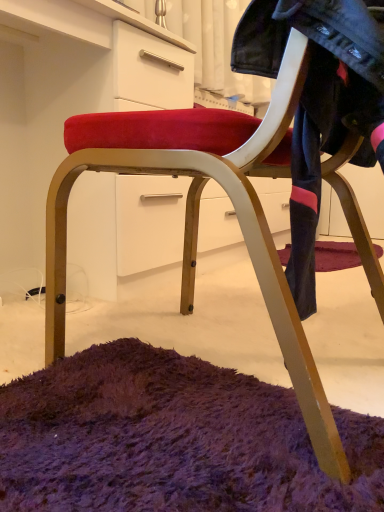
Question: Looking at the image, does matte white dresser at center seem bigger or smaller compared to denim jacket at upper right?

Choices:
 (A) small
 (B) big

Answer: (B)

Question: Considering the positions of matte white dresser at center and denim jacket at upper right in the image, is matte white dresser at center wider or thinner than denim jacket at upper right?

Choices:
 (A) thin
 (B) wide

Answer: (B)

Question: From a real-world perspective, relative to denim jacket at upper right, is matte white dresser at center vertically above or below?

Choices:
 (A) above
 (B) below

Answer: (B)

Question: Based on their sizes in the image, would you say denim jacket at upper right is bigger or smaller than matte white dresser at center?

Choices:
 (A) small
 (B) big

Answer: (A)

Question: Considering the positions of denim jacket at upper right and matte white dresser at center in the image, is denim jacket at upper right taller or shorter than matte white dresser at center?

Choices:
 (A) tall
 (B) short

Answer: (B)

Question: From the image's perspective, is denim jacket at upper right located above or below matte white dresser at center?

Choices:
 (A) below
 (B) above

Answer: (A)

Question: Considering their positions, is denim jacket at upper right located in front of or behind matte white dresser at center?

Choices:
 (A) behind
 (B) front

Answer: (B)